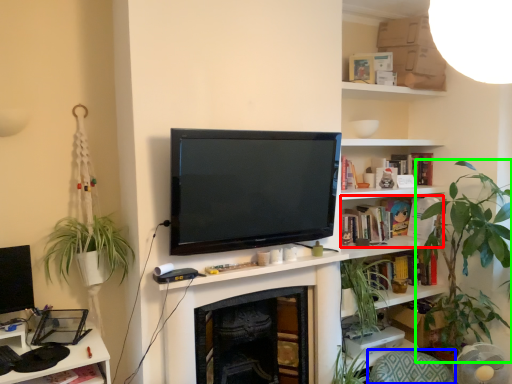
Question: Which object is the closest to the book (highlighted by a red box)? Choose among these: swivel chair (highlighted by a blue box) or houseplant (highlighted by a green box).

Choices:
 (A) swivel chair
 (B) houseplant

Answer: (B)